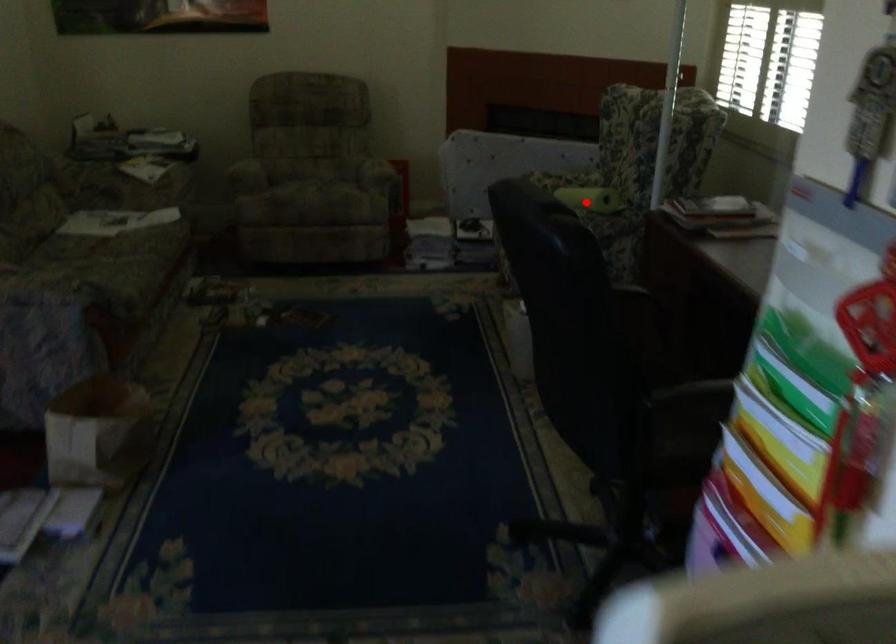
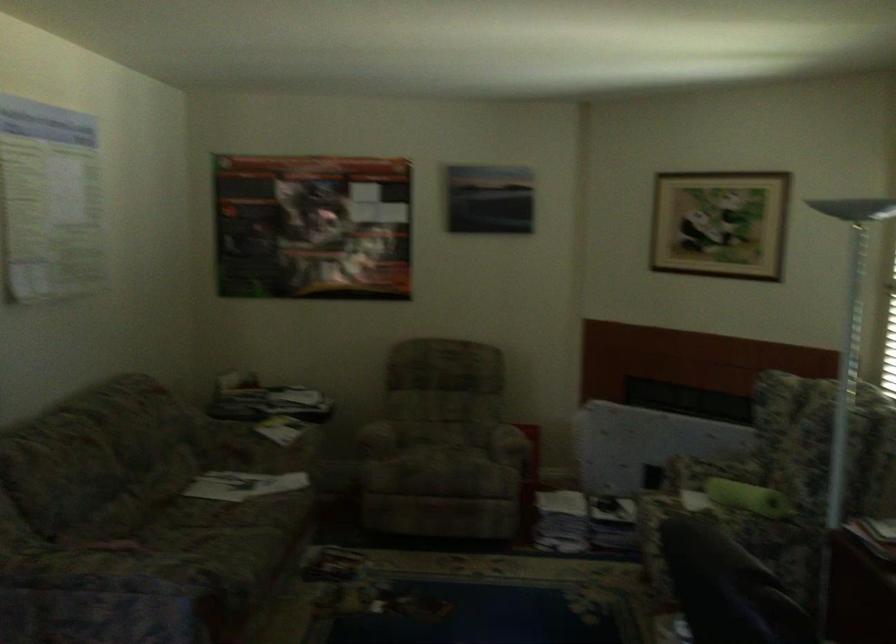
Question: I am providing you with two images of the same scene from different viewpoints. Image1 has a red point marked. In image2, the corresponding 3D location appears at what relative position? Reply with the corresponding letter.

Choices:
 (A) Closer
 (B) Farther

Answer: (A)